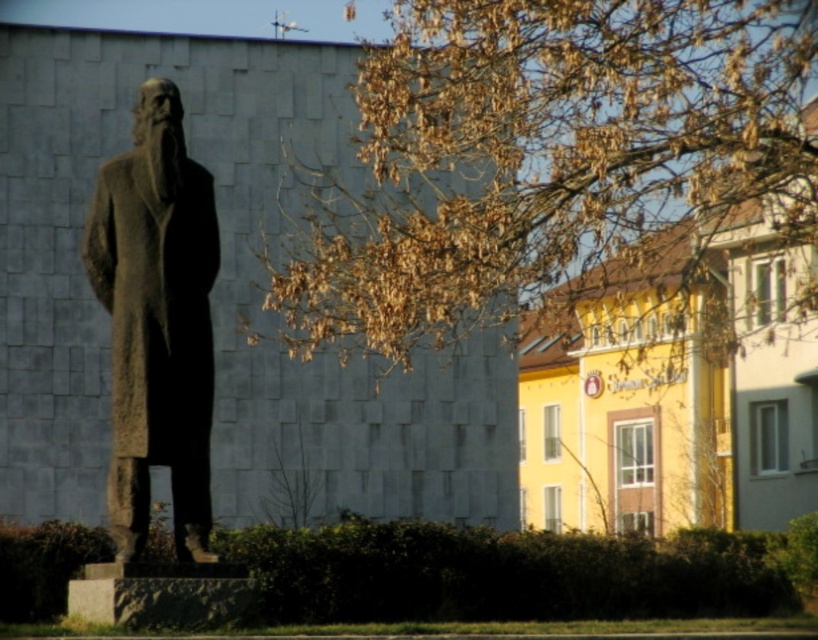
Question: Is brown leafy branches at upper center below rough stone robe at left?

Choices:
 (A) no
 (B) yes

Answer: (A)

Question: Does brown leafy branches at upper center lie in front of rough stone robe at left?

Choices:
 (A) yes
 (B) no

Answer: (B)

Question: Can you confirm if brown leafy branches at upper center is wider than rough stone robe at left?

Choices:
 (A) yes
 (B) no

Answer: (A)

Question: Which object is farther from the camera taking this photo?

Choices:
 (A) brown leafy branches at upper center
 (B) rough stone robe at left

Answer: (A)